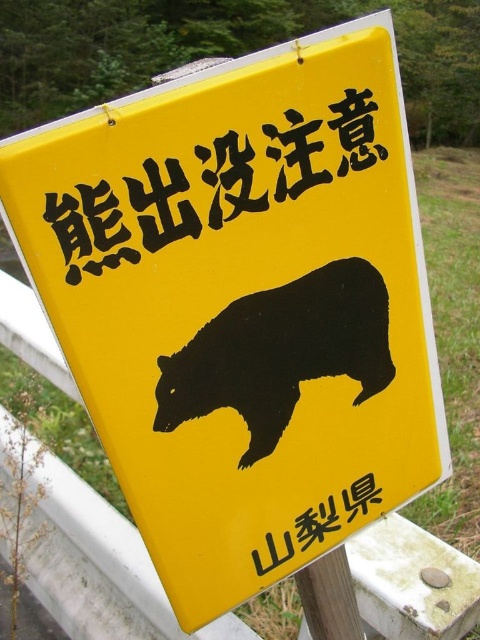
Question: Which object appears farthest from the camera in this image?

Choices:
 (A) blackmaterial/texture at upper center
 (B) wooden post at lower center
 (C) black silhouette bear at center
 (D) yellow paper at center

Answer: (B)

Question: Does yellow paper at center come behind wooden post at lower center?

Choices:
 (A) no
 (B) yes

Answer: (A)

Question: Which point is closer to the camera?

Choices:
 (A) wooden post at lower center
 (B) yellow paper at center
 (C) black silhouette bear at center
 (D) blackmaterial/texture at upper center

Answer: (D)

Question: Is blackmaterial/texture at upper center wider than black silhouette bear at center?

Choices:
 (A) no
 (B) yes

Answer: (B)

Question: Does black silhouette bear at center appear on the left side of wooden post at lower center?

Choices:
 (A) yes
 (B) no

Answer: (A)

Question: Among these objects, which one is farthest from the camera?

Choices:
 (A) yellow paper at center
 (B) blackmaterial/texture at upper center
 (C) black silhouette bear at center
 (D) wooden post at lower center

Answer: (D)